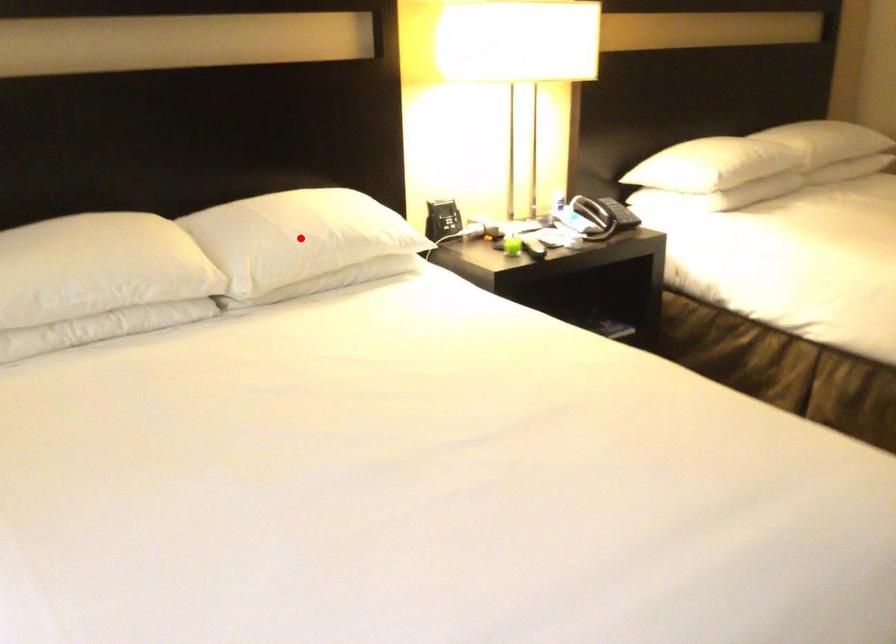
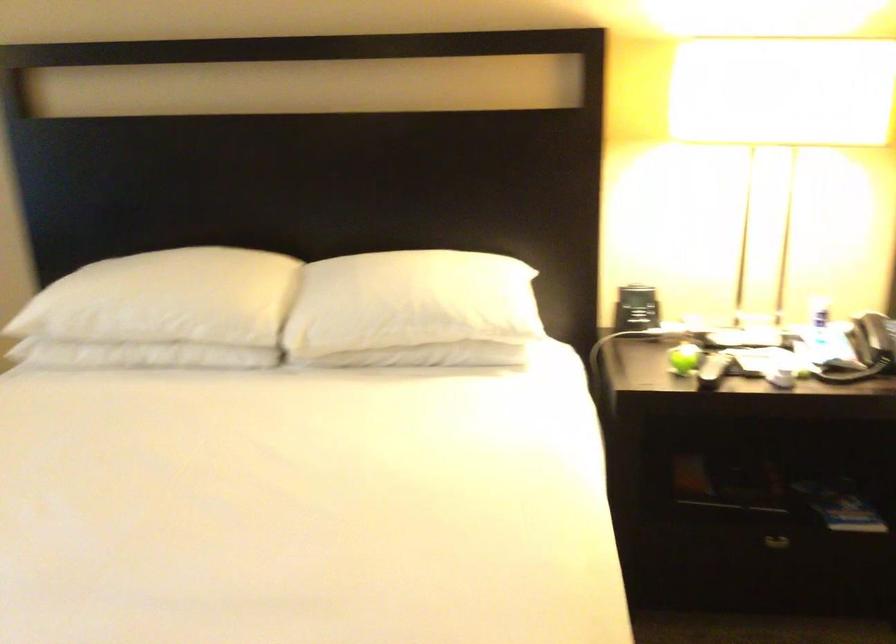
Where in the second image is the point corresponding to the highlighted location from the first image?

(382, 303)